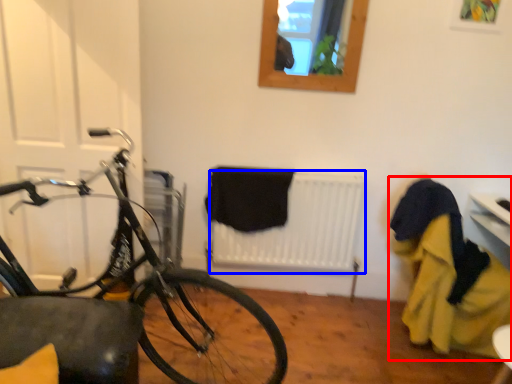
Question: Which of the following is the closest to the observer, laundry (highlighted by a red box) or radiator (highlighted by a blue box)?

Choices:
 (A) laundry
 (B) radiator

Answer: (A)